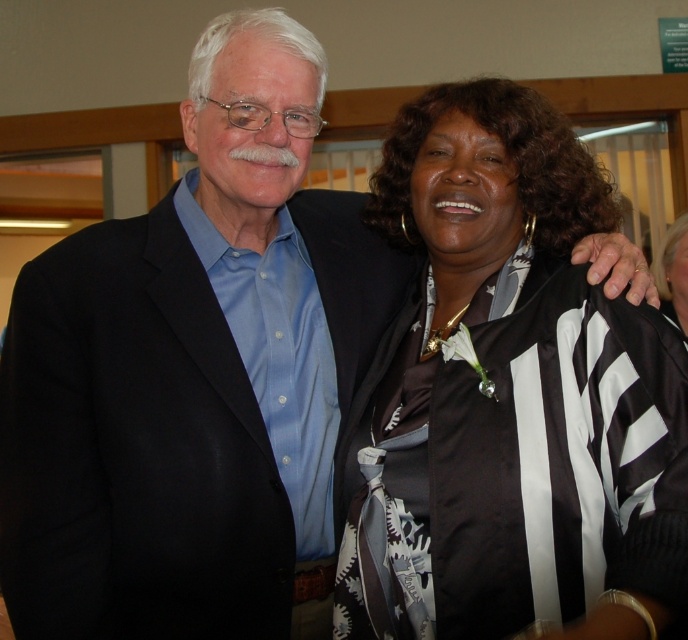
Does black satin suit at left appear over black satin jacket at upper right?

Yes.

Between point (118, 246) and point (451, 371), which one is positioned in front?

Positioned in front is point (451, 371).

I want to click on black satin suit at left, so click(x=193, y=372).